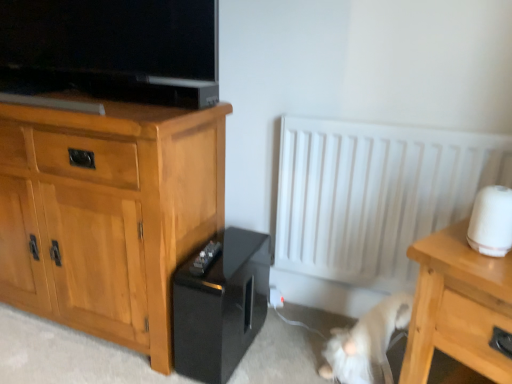
Identify the location of white matte radiator at center. (371, 201).

Describe the element at coordinates (458, 306) in the screenshot. I see `light wood/texture nightstand at lower right` at that location.

At what (x,y) coordinates should I click in order to perform the action: click on black glossy amplifier at lower center. Please return your answer as a coordinate pair (x, y). The width and height of the screenshot is (512, 384). Looking at the image, I should click on pos(221,307).

Where is `white matte radiator at center`? white matte radiator at center is located at coordinates (371, 201).

Considering the relative positions of white fur cat at lower right and light wood/texture nightstand at lower right in the image provided, is white fur cat at lower right to the right of light wood/texture nightstand at lower right from the viewer's perspective?

No, white fur cat at lower right is not to the right of light wood/texture nightstand at lower right.

Between white fur cat at lower right and light wood/texture nightstand at lower right, which one has smaller width?

white fur cat at lower right is thinner.

Who is smaller, white fur cat at lower right or light wood/texture nightstand at lower right?

With smaller size is white fur cat at lower right.

How many degrees apart are the facing directions of white matte radiator at center and light wood cabinet at left?

0.595 degrees.

Is white matte radiator at center taller or shorter than light wood cabinet at left?

In the image, white matte radiator at center appears to be shorter than light wood cabinet at left.

Considering the points (503, 167) and (151, 126), which point is in front, point (503, 167) or point (151, 126)?

Point (151, 126)

I want to click on the chest of drawers directly beneath the white matte radiator at center (from a real-world perspective), so click(106, 213).

What's the angular difference between light wood cabinet at left and white matte radiator at center's facing directions?

The angular difference between light wood cabinet at left and white matte radiator at center is 0.595 degrees.

Is light wood cabinet at left looking in the opposite direction of white matte radiator at center?

No, light wood cabinet at left's orientation is not away from white matte radiator at center.

Is light wood cabinet at left bigger or smaller than white matte radiator at center?

In the image, light wood cabinet at left appears to be larger than white matte radiator at center.

Is light wood cabinet at left inside the boundaries of white matte radiator at center, or outside?

light wood cabinet at left is not inside white matte radiator at center, it's outside.

Considering the sizes of objects white matte radiator at center and black glossy amplifier at lower center in the image provided, who is smaller, white matte radiator at center or black glossy amplifier at lower center?

black glossy amplifier at lower center.

Would you consider white matte radiator at center to be distant from black glossy amplifier at lower center?

white matte radiator at center is actually quite close to black glossy amplifier at lower center.

From a real-world perspective, who is located lower, white matte radiator at center or black glossy amplifier at lower center?

In real-world perspective, black glossy amplifier at lower center is lower.

Is white matte radiator at center located outside black glossy amplifier at lower center?

That's correct, white matte radiator at center is outside of black glossy amplifier at lower center.

Does point (397, 295) lie behind point (90, 135)?

Yes, point (397, 295) is behind point (90, 135).

Considering the relative positions of white fur cat at lower right and light wood cabinet at left in the image provided, is white fur cat at lower right in front of light wood cabinet at left?

No, the depth of white fur cat at lower right is greater than that of light wood cabinet at left.

Can you tell me how much white fur cat at lower right and light wood cabinet at left differ in facing direction?

35.1 degrees.

Is white fur cat at lower right wider than light wood cabinet at left?

No, white fur cat at lower right is not wider than light wood cabinet at left.

Is white matte radiator at center at the back of white fur cat at lower right?

white fur cat at lower right is not turned away from white matte radiator at center.

Which of these two, white fur cat at lower right or white matte radiator at center, is bigger?

white matte radiator at center.

Which point is more distant from viewer, (330,343) or (349,216)?

The point (349,216) is farther from the camera.

Based on their positions, is light wood/texture nightstand at lower right located to the left or right of white fur cat at lower right?

Based on their positions, light wood/texture nightstand at lower right is located to the right of white fur cat at lower right.

From the image's perspective, does light wood/texture nightstand at lower right appear lower than white fur cat at lower right?

Incorrect, from the image's perspective, light wood/texture nightstand at lower right is higher than white fur cat at lower right.

Does light wood/texture nightstand at lower right have a lesser width compared to white fur cat at lower right?

Incorrect, the width of light wood/texture nightstand at lower right is not less than that of white fur cat at lower right.

Identify the location of animal behind the light wood/texture nightstand at lower right. Image resolution: width=512 pixels, height=384 pixels. (366, 342).

The width and height of the screenshot is (512, 384). What are the coordinates of `chest of drawers above the white matte radiator at center (from the image's perspective)` in the screenshot? It's located at (106, 213).

From the image, which object appears to be farther from black glossy amplifier at lower center, light wood/texture nightstand at lower right or white fur cat at lower right?

Among the two, light wood/texture nightstand at lower right is located further to black glossy amplifier at lower center.

Consider the image. Based on their spatial positions, is light wood cabinet at left or white matte radiator at center further from white fur cat at lower right?

light wood cabinet at left is positioned further to the anchor white fur cat at lower right.

Looking at the image, which one is located further to black glossy amplifier at lower center, light wood/texture nightstand at lower right or white matte radiator at center?

The object further to black glossy amplifier at lower center is light wood/texture nightstand at lower right.

When comparing their distances from light wood cabinet at left, does light wood/texture nightstand at lower right or black glossy amplifier at lower center seem closer?

black glossy amplifier at lower center.

Looking at the image, which one is located closer to white fur cat at lower right, light wood/texture nightstand at lower right or black glossy amplifier at lower center?

light wood/texture nightstand at lower right is closer to white fur cat at lower right.

From the image, which object appears to be farther from light wood cabinet at left, black glossy amplifier at lower center or white matte radiator at center?

The object further to light wood cabinet at left is white matte radiator at center.

Considering their positions, is white matte radiator at center positioned closer to light wood cabinet at left than light wood/texture nightstand at lower right?

white matte radiator at center is positioned closer to the anchor light wood cabinet at left.

Considering their positions, is white fur cat at lower right positioned closer to light wood/texture nightstand at lower right than white matte radiator at center?

white fur cat at lower right is closer to light wood/texture nightstand at lower right.

You are a GUI agent. You are given a task and a screenshot of the screen. Output one action in this format:
    pyautogui.click(x=<x>, y=<y>)
    Task: Click on the radiator between black glossy amplifier at lower center and light wood/texture nightstand at lower right from left to right
    Image resolution: width=512 pixels, height=384 pixels.
    Given the screenshot: What is the action you would take?
    pyautogui.click(x=371, y=201)

This screenshot has height=384, width=512. I want to click on animal positioned between light wood/texture nightstand at lower right and white matte radiator at center from near to far, so click(x=366, y=342).

Identify the location of amplifier between light wood cabinet at left and white matte radiator at center from left to right. (221, 307).

Where is `animal between black glossy amplifier at lower center and white matte radiator at center from left to right`? The height and width of the screenshot is (384, 512). animal between black glossy amplifier at lower center and white matte radiator at center from left to right is located at coordinates (366, 342).